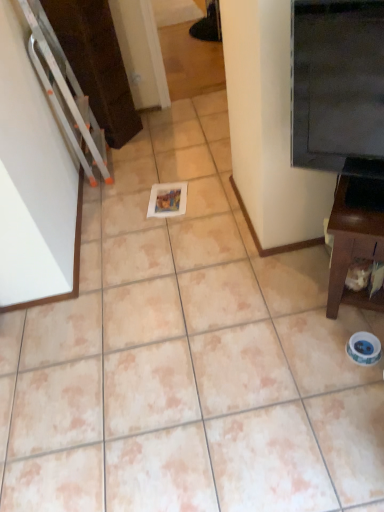
Locate an element on the screen. free point below black glossy fridge at upper right (from a real-world perspective) is located at coordinates (304, 281).